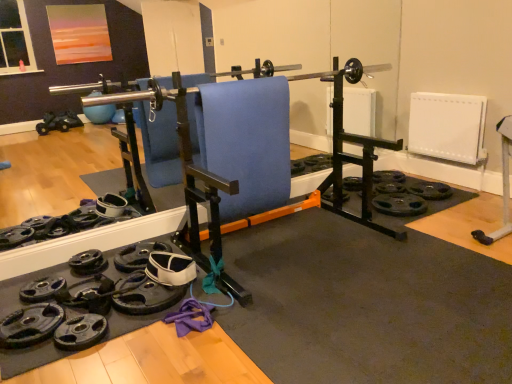
This screenshot has height=384, width=512. In order to click on blank space situated above black rubber weight plate at lower left, which is the first wheel in left-to-right order (from a real-world perspective) in this screenshot , I will do `click(42, 312)`.